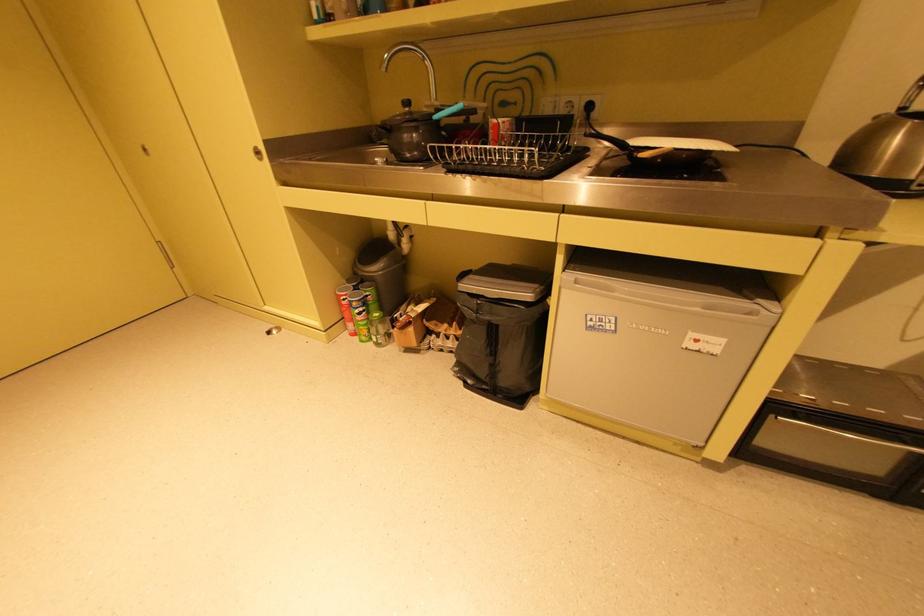
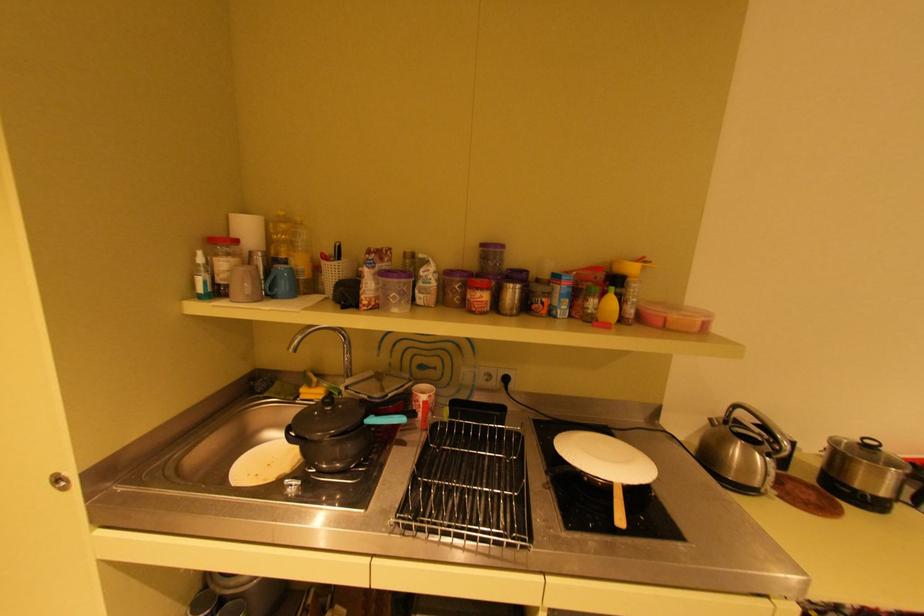
Locate, in the second image, the point that corresponds to [264,153] in the first image.

(65, 479)